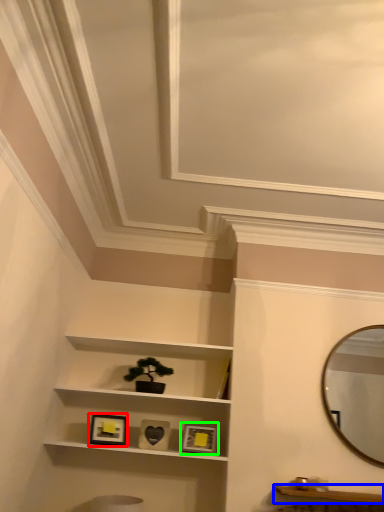
Question: Estimate the real-world distances between objects in this image. Which object is closer to picture frame (highlighted by a red box), cabinetry (highlighted by a blue box) or picture frame (highlighted by a green box)?

Choices:
 (A) cabinetry
 (B) picture frame

Answer: (B)